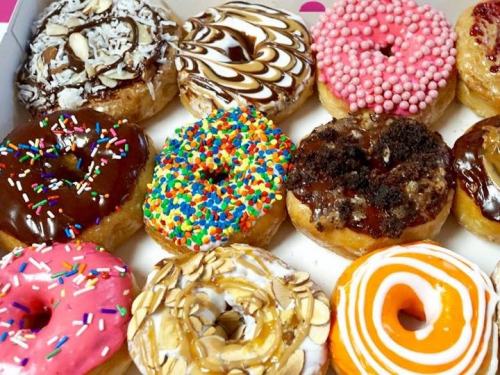
I want to click on box, so click(x=312, y=254).